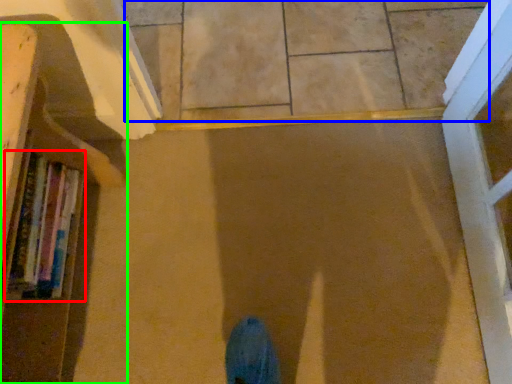
Question: Estimate the real-world distances between objects in this image. Which object is farther from book (highlighted by a red box), tile (highlighted by a blue box) or bookcase (highlighted by a green box)?

Choices:
 (A) tile
 (B) bookcase

Answer: (A)